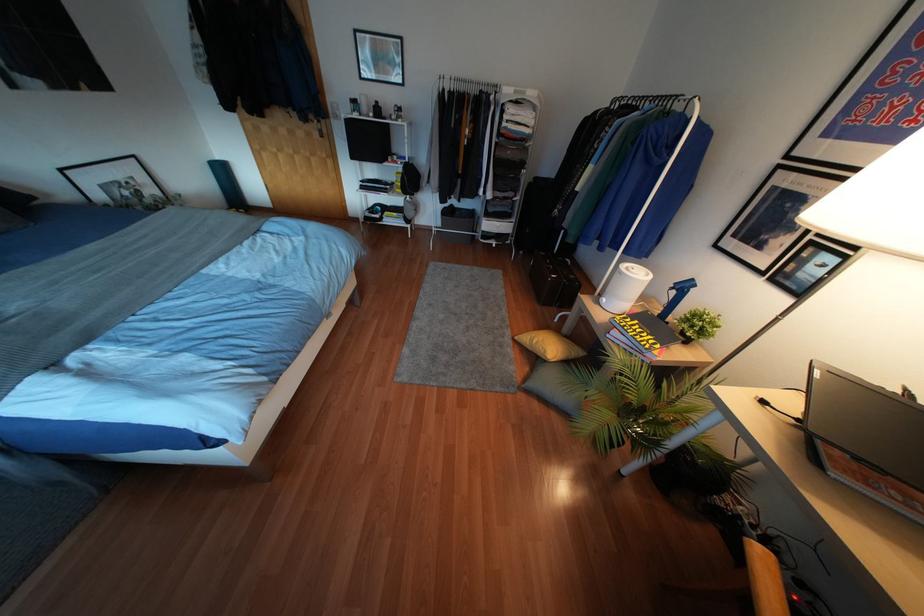
Where would you lift the yellow cushion? Please return your answer as a coordinate pair (x, y).

(550, 345)